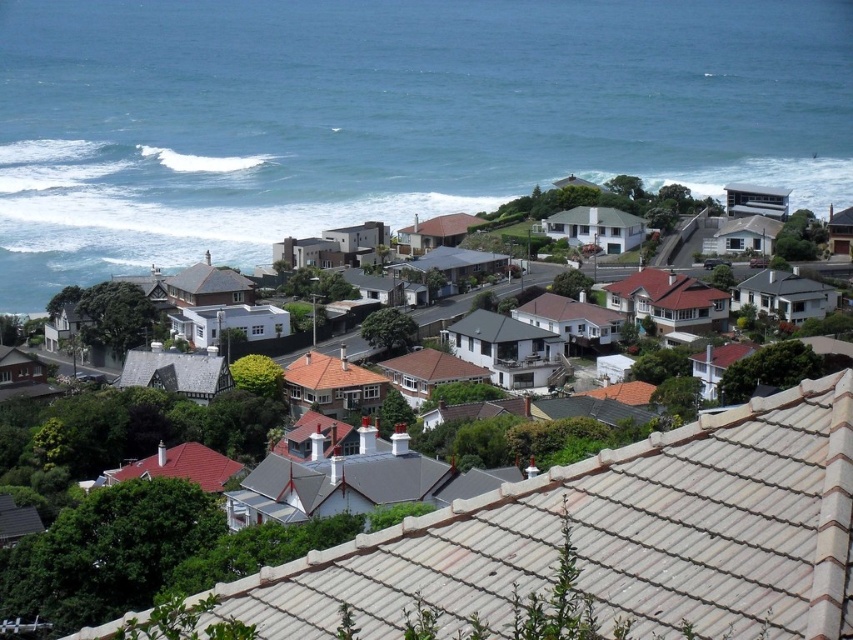
Question: Which object appears farthest from the camera in this image?

Choices:
 (A) white tile houses at center
 (B) blue water at center

Answer: (B)

Question: Is blue water at center above white tile houses at center?

Choices:
 (A) yes
 (B) no

Answer: (A)

Question: Can you confirm if blue water at center is thinner than white tile houses at center?

Choices:
 (A) no
 (B) yes

Answer: (A)

Question: Where is blue water at center located in relation to white tile houses at center in the image?

Choices:
 (A) below
 (B) above

Answer: (B)